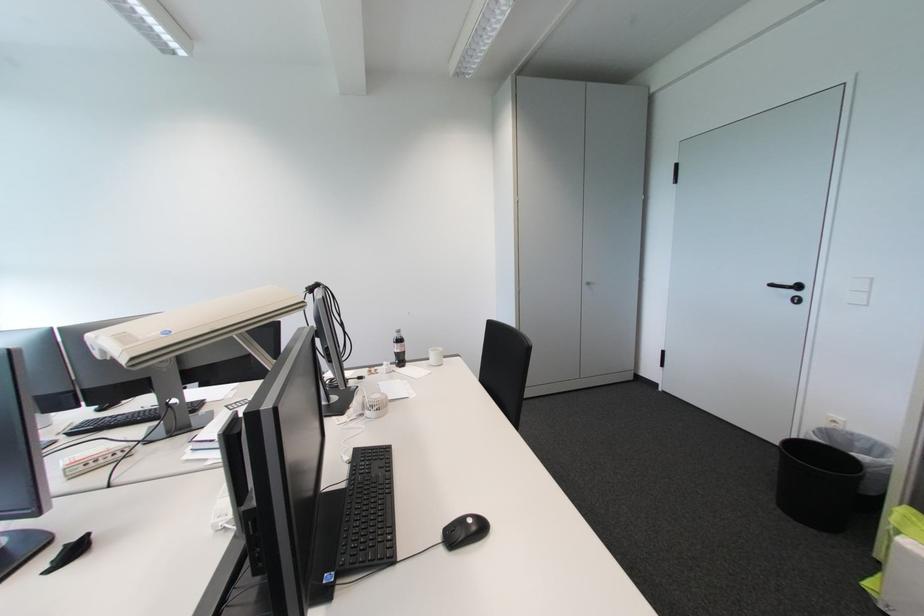
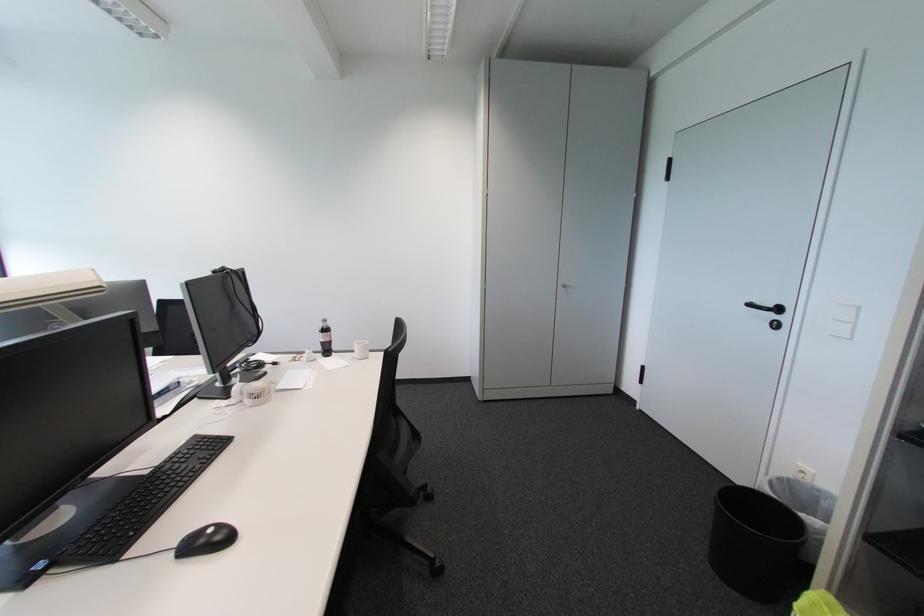
Find the pixel in the second image that matches pixel 591 286 in the first image.

(567, 290)